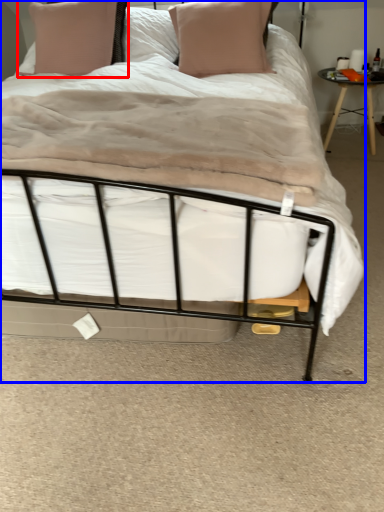
Question: Among these objects, which one is nearest to the camera, pillow (highlighted by a red box) or bed (highlighted by a blue box)?

Choices:
 (A) pillow
 (B) bed

Answer: (B)